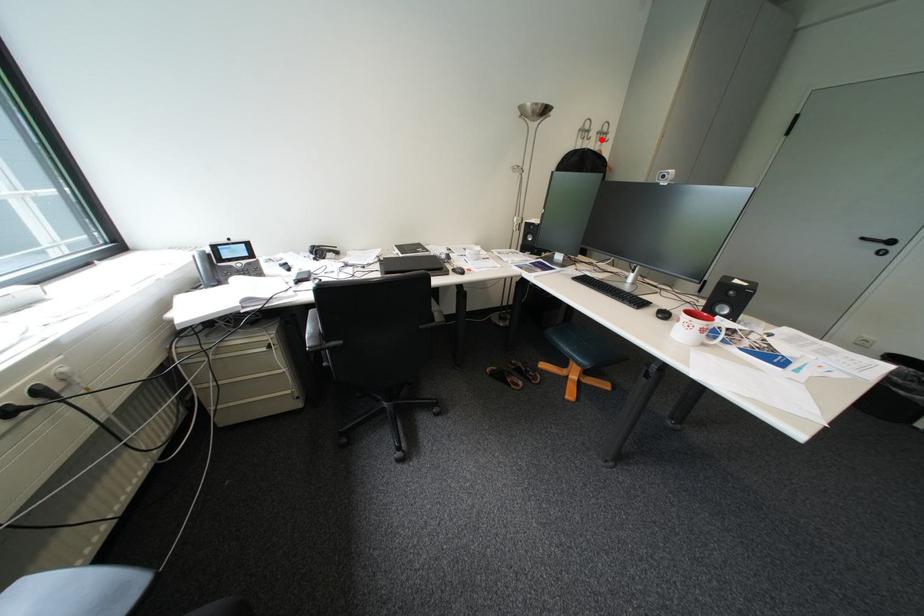
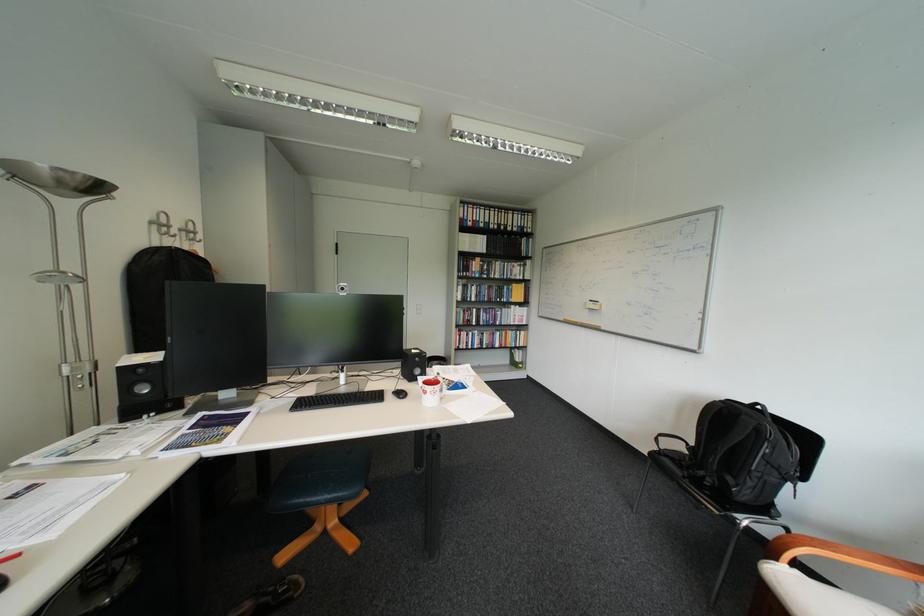
Question: I am providing you with two images of the same scene from different viewpoints. Given a red point in image1, look at the same physical point in image2. Is it:

Choices:
 (A) Closer to the viewpoint
 (B) Farther from the viewpoint

Answer: (B)